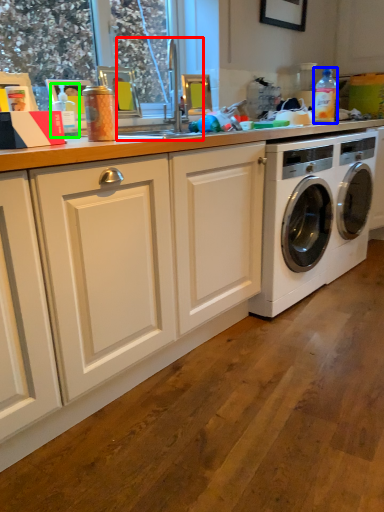
Question: Which is nearer to the sink (highlighted by a red box)? bottle (highlighted by a blue box) or bottle (highlighted by a green box).

Choices:
 (A) bottle
 (B) bottle

Answer: (B)